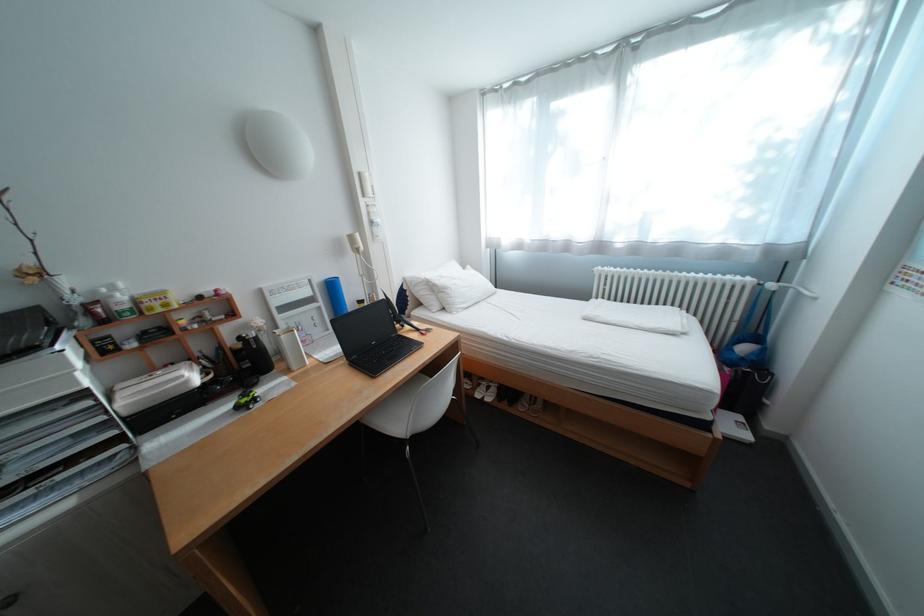
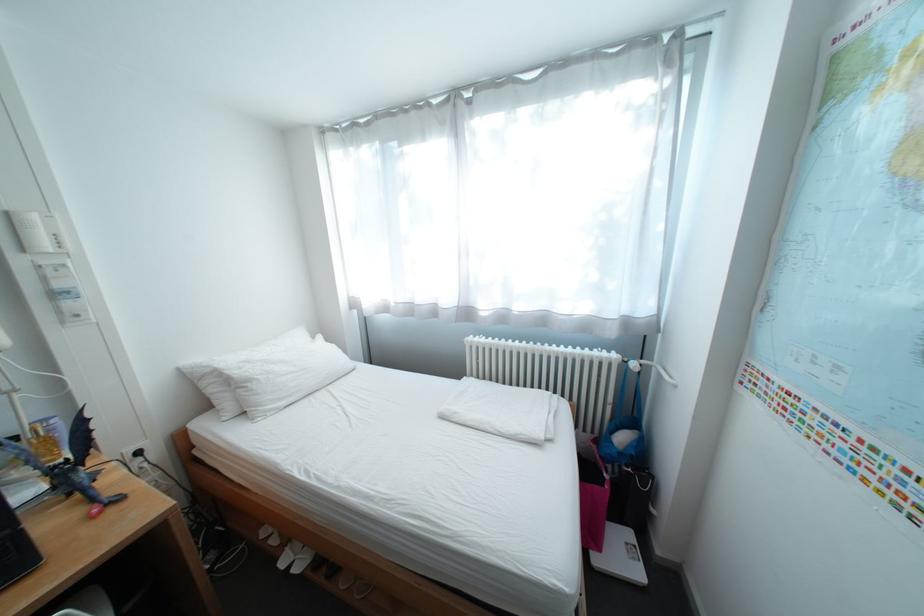
Find the pixel in the second image that matches point (459, 290) in the first image.

(263, 383)